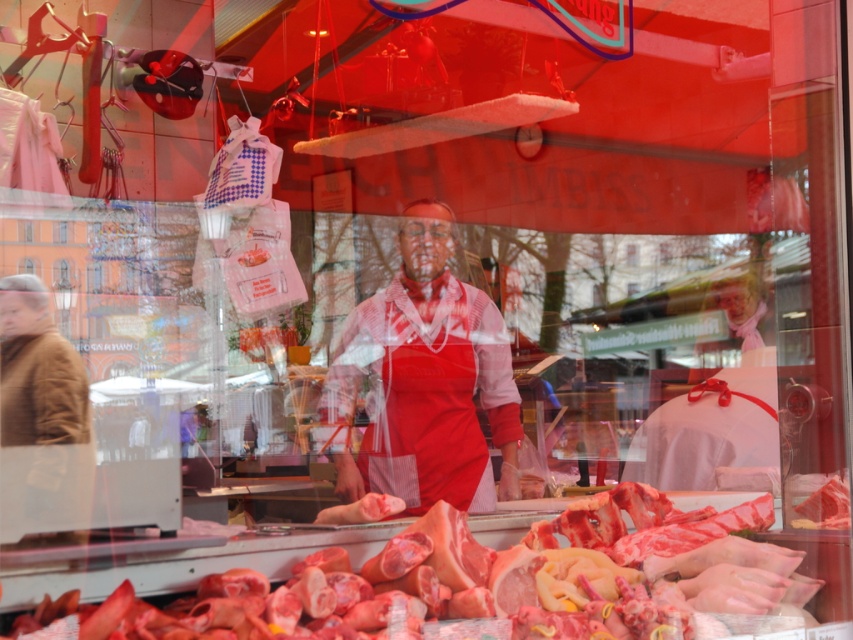
Question: Which is farther from the brown wool coat at left?

Choices:
 (A) red plaid shirt at center
 (B) pinkish raw meat at center

Answer: (B)

Question: Can you confirm if red plaid shirt at center is bigger than brown wool coat at left?

Choices:
 (A) no
 (B) yes

Answer: (B)

Question: Considering the relative positions of red plaid shirt at center and brown wool coat at left in the image provided, where is red plaid shirt at center located with respect to brown wool coat at left?

Choices:
 (A) below
 (B) above

Answer: (B)

Question: Which object is farther from the camera taking this photo?

Choices:
 (A) pinkish raw meat at center
 (B) brown wool coat at left
 (C) red plaid shirt at center

Answer: (C)

Question: Estimate the real-world distances between objects in this image. Which object is farther from the red plaid shirt at center?

Choices:
 (A) pinkish raw meat at center
 (B) brown wool coat at left

Answer: (B)

Question: Is red plaid shirt at center wider than brown wool coat at left?

Choices:
 (A) yes
 (B) no

Answer: (A)